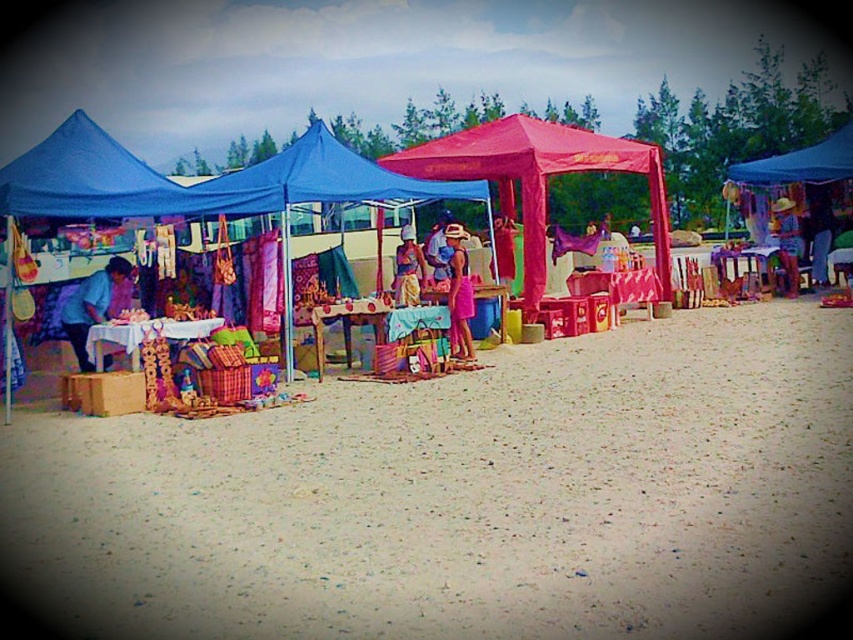
You are a customer walking through the outdoor market. You see the pink fabric canopy at center and the matte purple fabric at left. Which fabric is positioned higher relative to the other?

The pink fabric canopy at center is located above the matte purple fabric at left, so it is positioned higher.